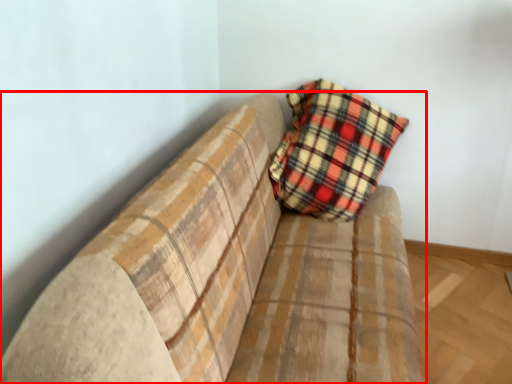
Question: Considering the relative positions of studio couch (annotated by the red box) and pillow in the image provided, where is studio couch (annotated by the red box) located with respect to the staircase?

Choices:
 (A) right
 (B) left

Answer: (B)